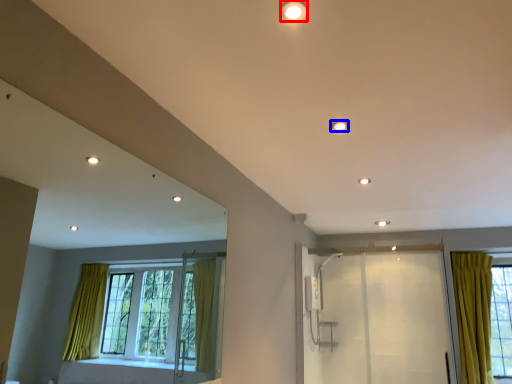
Question: Which object appears farthest to the camera in this image, lighting (highlighted by a red box) or lighting (highlighted by a blue box)?

Choices:
 (A) lighting
 (B) lighting

Answer: (B)